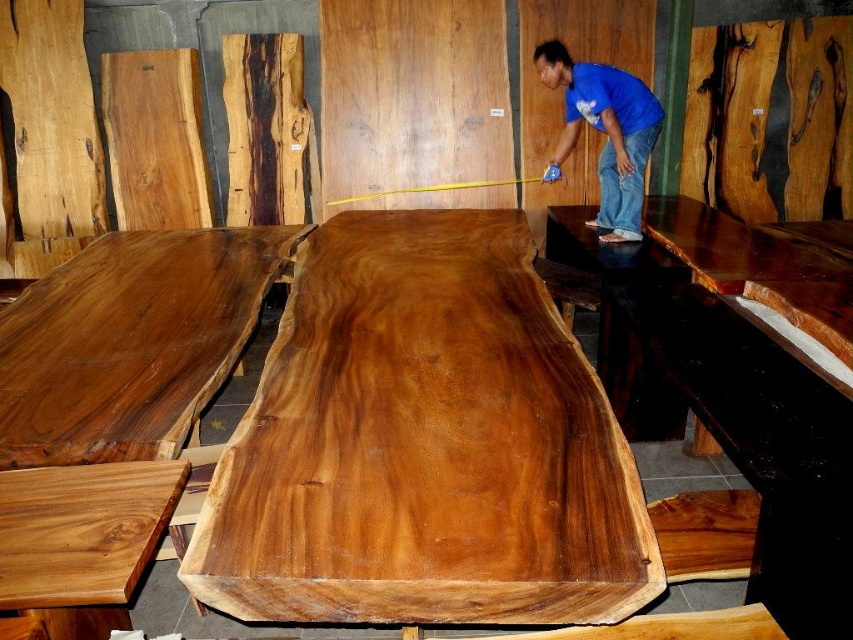
Question: Among these objects, which one is nearest to the camera?

Choices:
 (A) blue cotton shirt at upper center
 (B) satin wood table at center

Answer: (B)

Question: Which point is closer to the camera?

Choices:
 (A) blue cotton shirt at upper center
 (B) satin wood table at center

Answer: (B)

Question: Does satin wood table at center have a greater width compared to blue cotton shirt at upper center?

Choices:
 (A) yes
 (B) no

Answer: (A)

Question: Is satin wood table at center behind blue cotton shirt at upper center?

Choices:
 (A) yes
 (B) no

Answer: (B)

Question: Does satin wood table at center have a smaller size compared to blue cotton shirt at upper center?

Choices:
 (A) no
 (B) yes

Answer: (A)